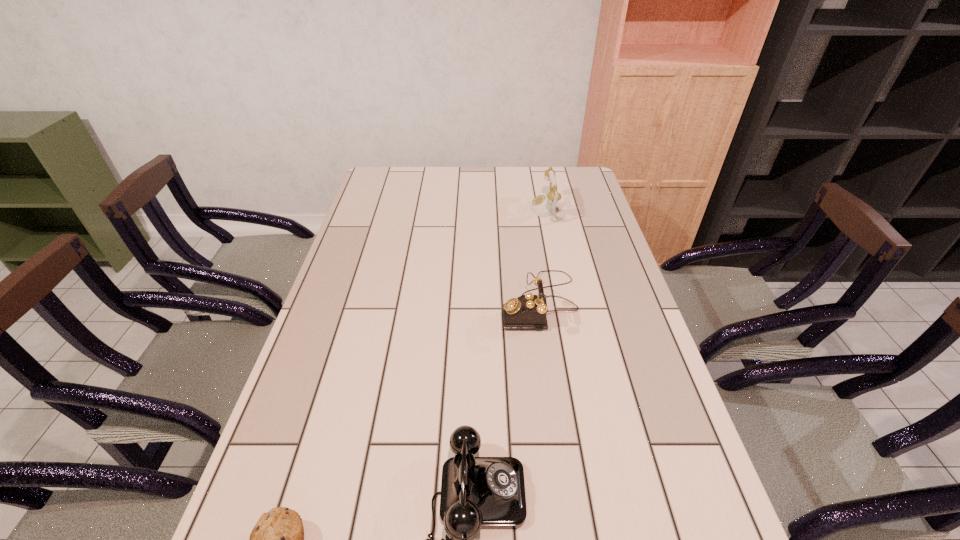
The height and width of the screenshot is (540, 960). In the image, there is a desktop. Find the location of `vacant space at the left edge`. vacant space at the left edge is located at coordinates (288, 440).

Find the location of `free space at the right edge of the desktop`. free space at the right edge of the desktop is located at coordinates (641, 350).

Identify the location of vacant space at the far right corner. This screenshot has height=540, width=960. (581, 187).

Locate an element on the screen. vacant area between the farthest object and the second farthest object is located at coordinates click(542, 256).

Where is `object that is the nearest to the farthest telephone`? object that is the nearest to the farthest telephone is located at coordinates (528, 311).

Image resolution: width=960 pixels, height=540 pixels. I want to click on object that ranks as the second closest to the second shortest object, so click(x=528, y=311).

Find the location of a particular element. This screenshot has height=540, width=960. the closest telephone to the shortest telephone is located at coordinates (528, 311).

Locate which telephone is the closest to the third tallest object. Please provide its 2D coordinates. Your answer should be formatted as a tuple, i.e. [(x, y)], where the tuple contains the x and y coordinates of a point satisfying the conditions above.

[(528, 311)]